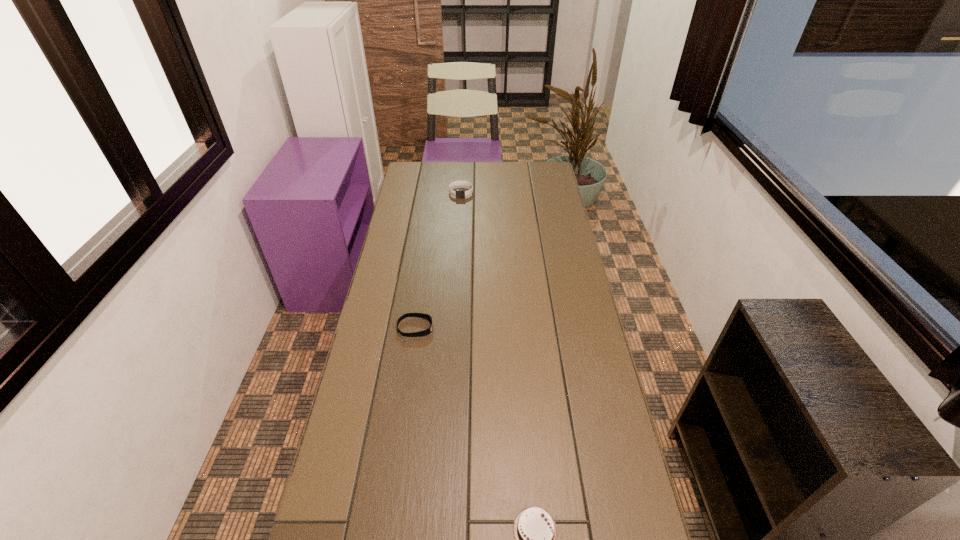
You are a GUI agent. You are given a task and a screenshot of the screen. Output one action in this format:
    pyautogui.click(x=<x>, y=<y>)
    Task: Click on the tallest object
    The width and height of the screenshot is (960, 540).
    Given the screenshot: What is the action you would take?
    pyautogui.click(x=458, y=193)

This screenshot has height=540, width=960. Find the location of `the right wristband`. the right wristband is located at coordinates (458, 193).

Where is `the second farthest object`? This screenshot has height=540, width=960. the second farthest object is located at coordinates (420, 315).

Where is `the shorter wristband`? This screenshot has height=540, width=960. the shorter wristband is located at coordinates (420, 315).

In order to click on vacant point located 0.390m on the outer surface of the second object from right to left in this screenshot , I will do `click(458, 252)`.

You are a GUI agent. You are given a task and a screenshot of the screen. Output one action in this format:
    pyautogui.click(x=<x>, y=<y>)
    Task: Click on the vacant space located 0.390m on the display of the leftmost object
    Image resolution: width=960 pixels, height=540 pixels.
    Given the screenshot: What is the action you would take?
    pyautogui.click(x=553, y=328)

Where is `object that is at the left edge`? This screenshot has width=960, height=540. object that is at the left edge is located at coordinates (420, 315).

The height and width of the screenshot is (540, 960). In the image, there is a desktop. What are the coordinates of `vacant region at the left edge` in the screenshot? It's located at (367, 453).

Where is `vacant space at the right edge`? This screenshot has width=960, height=540. vacant space at the right edge is located at coordinates (572, 273).

Where is `vacant area at the far left corner of the desktop`? vacant area at the far left corner of the desktop is located at coordinates (433, 183).